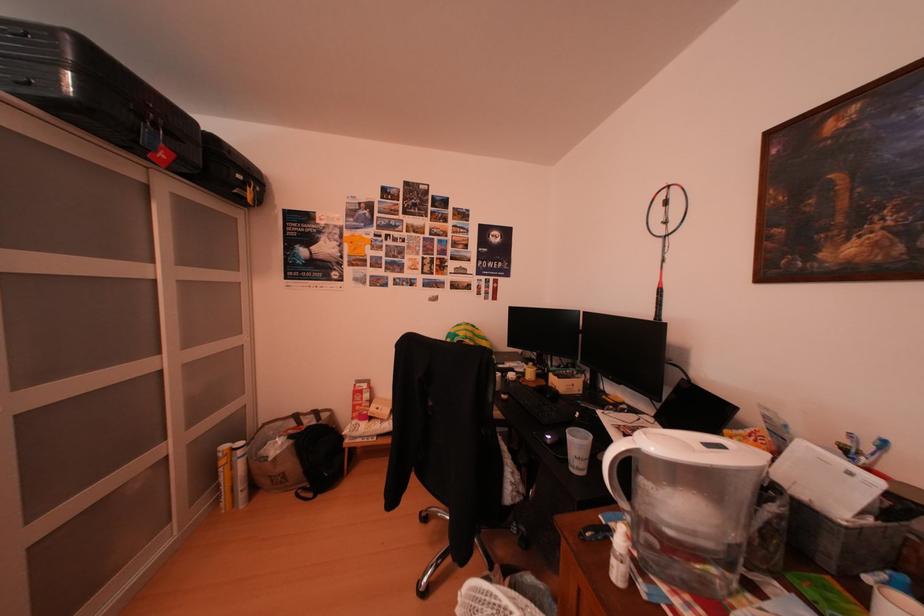
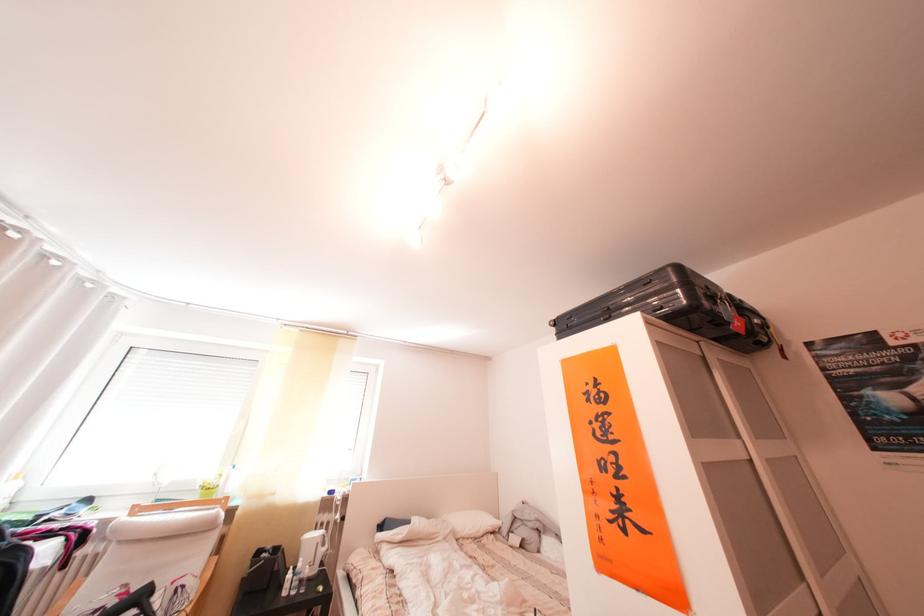
Where in the second image is the point corresponding to pixel 136 152 from the first image?

(703, 336)